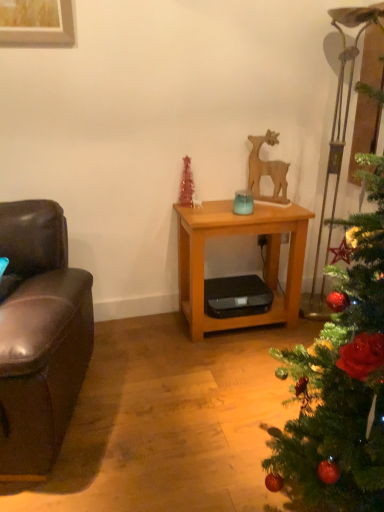
What are the coordinates of `free point above wooden table at center (from a real-world perspective)` in the screenshot? It's located at (232, 209).